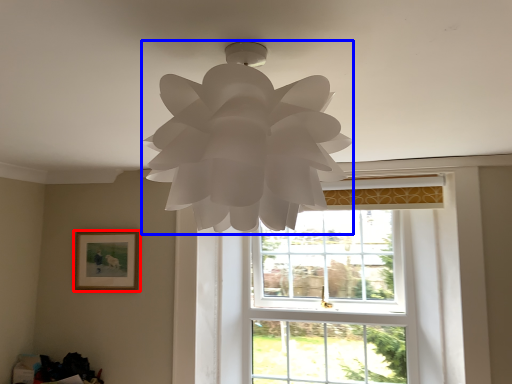
Question: Among these objects, which one is farthest to the camera, picture frame (highlighted by a red box) or lamp (highlighted by a blue box)?

Choices:
 (A) picture frame
 (B) lamp

Answer: (A)